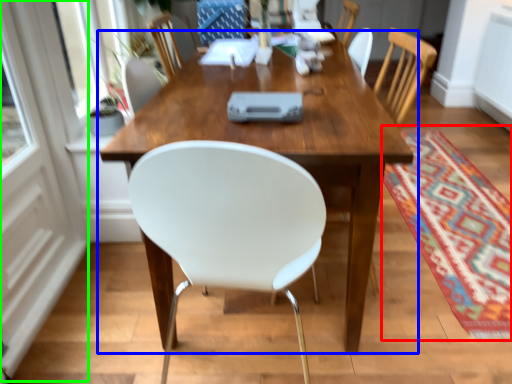
Question: Which is farther away from mat (highlighted by a red box)? table (highlighted by a blue box) or screen door (highlighted by a green box)?

Choices:
 (A) table
 (B) screen door

Answer: (B)